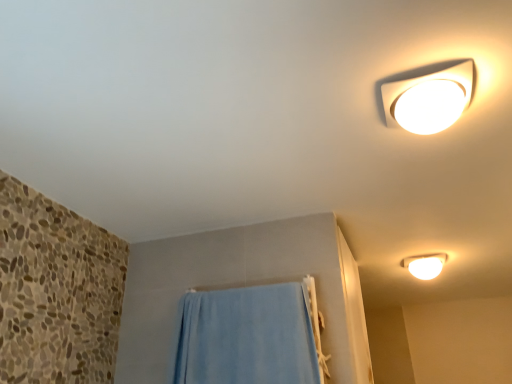
Question: Is blue fabric towel at lower center smaller than white glossy light fixture at upper right, which ranks as the 1th lamp in back-to-front order?

Choices:
 (A) no
 (B) yes

Answer: (A)

Question: Can you confirm if blue fabric towel at lower center is wider than white glossy light fixture at upper right, placed as the second lamp when sorted from left to right?

Choices:
 (A) yes
 (B) no

Answer: (B)

Question: Does blue fabric towel at lower center have a larger size compared to white glossy light fixture at upper right, marked as the 2th lamp in a top-to-bottom arrangement?

Choices:
 (A) no
 (B) yes

Answer: (B)

Question: Can we say blue fabric towel at lower center lies outside white glossy light fixture at upper right, marked as the 2th lamp in a top-to-bottom arrangement?

Choices:
 (A) yes
 (B) no

Answer: (A)

Question: Does blue fabric towel at lower center have a lesser width compared to white glossy light fixture at upper right, placed as the second lamp when sorted from left to right?

Choices:
 (A) yes
 (B) no

Answer: (A)

Question: From the image's perspective, is blue fabric towel at lower center above or below white glossy light fixture at upper right, which ranks as the 1th lamp in back-to-front order?

Choices:
 (A) above
 (B) below

Answer: (B)

Question: In the image, is blue fabric towel at lower center positioned in front of or behind white glossy light fixture at upper right, the second lamp from the front?

Choices:
 (A) front
 (B) behind

Answer: (A)

Question: Is blue fabric towel at lower center wider or thinner than white glossy light fixture at upper right, which ranks as the 1th lamp in back-to-front order?

Choices:
 (A) wide
 (B) thin

Answer: (B)

Question: Considering the positions of point (217, 365) and point (407, 261), is point (217, 365) closer or farther from the camera than point (407, 261)?

Choices:
 (A) farther
 (B) closer

Answer: (B)

Question: In terms of height, does white glossy light fixture at upper right, marked as the 2th lamp in a top-to-bottom arrangement, look taller or shorter compared to white glossy ceiling light at upper right, the second lamp from the right?

Choices:
 (A) short
 (B) tall

Answer: (B)

Question: Considering their positions, is white glossy light fixture at upper right, the second lamp from the front, located in front of or behind white glossy ceiling light at upper right, the 2th lamp positioned from the bottom?

Choices:
 (A) behind
 (B) front

Answer: (A)

Question: Considering the positions of white glossy light fixture at upper right, the first lamp positioned from the right, and white glossy ceiling light at upper right, which is the first lamp from front to back, in the image, is white glossy light fixture at upper right, the first lamp positioned from the right, bigger or smaller than white glossy ceiling light at upper right, which is the first lamp from front to back,?

Choices:
 (A) big
 (B) small

Answer: (A)

Question: From the image's perspective, is white glossy light fixture at upper right, marked as the 2th lamp in a top-to-bottom arrangement, located above or below white glossy ceiling light at upper right, which ranks as the 1th lamp in top-to-bottom order?

Choices:
 (A) below
 (B) above

Answer: (A)

Question: From the image's perspective, relative to white glossy ceiling light at upper right, which is the first lamp from front to back, is blue fabric towel at lower center above or below?

Choices:
 (A) above
 (B) below

Answer: (B)

Question: Relative to white glossy ceiling light at upper right, which is the first lamp from front to back, is blue fabric towel at lower center in front or behind?

Choices:
 (A) behind
 (B) front

Answer: (A)